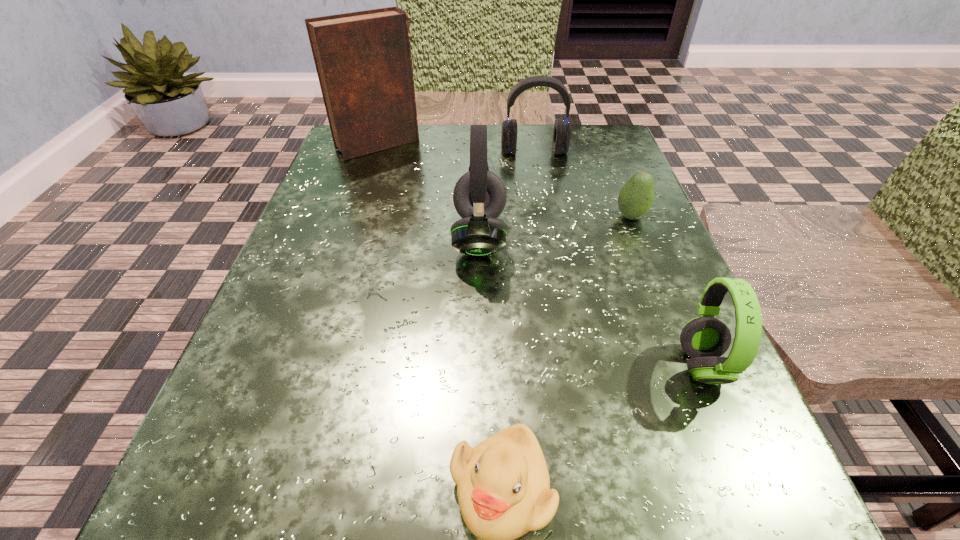
Identify which headset is located as the second nearest to the avocado. Please provide its 2D coordinates. Your answer should be formatted as a tuple, i.e. [(x, y)], where the tuple contains the x and y coordinates of a point satisfying the conditions above.

[(479, 196)]

Point out which headset is positioned as the second nearest to the second tallest object. Please provide its 2D coordinates. Your answer should be formatted as a tuple, i.e. [(x, y)], where the tuple contains the x and y coordinates of a point satisfying the conditions above.

[(704, 339)]

Where is `free region that satisfies the following two spatial constraints: 1. on the front side of the tallest object; 2. on the right side of the fifth farthest object`? Image resolution: width=960 pixels, height=540 pixels. free region that satisfies the following two spatial constraints: 1. on the front side of the tallest object; 2. on the right side of the fifth farthest object is located at coordinates (306, 366).

I want to click on vacant area in the image that satisfies the following two spatial constraints: 1. on the headband of the farthest headset; 2. on the left side of the fifth farthest object, so click(571, 366).